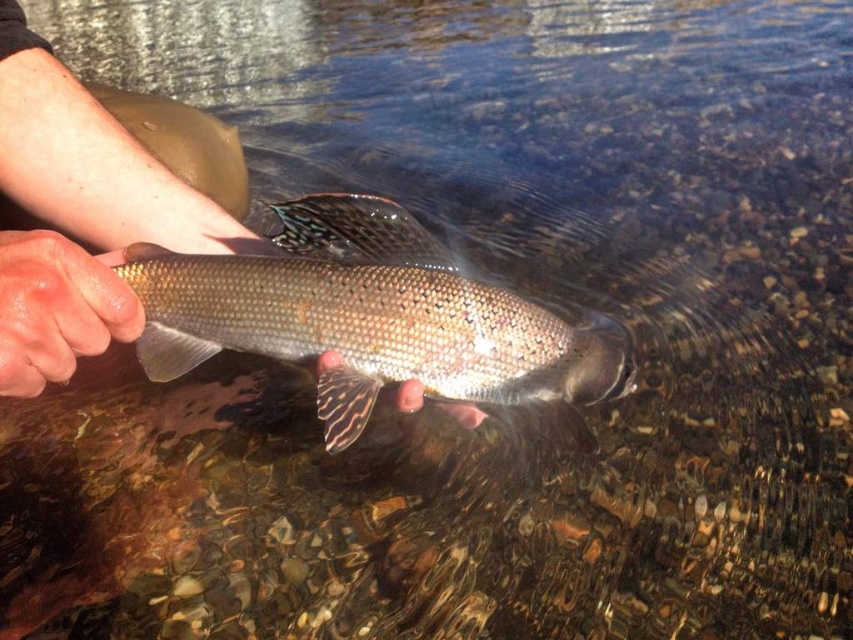
Which is behind, point (405, 234) or point (76, 284)?

Positioned behind is point (405, 234).

Can you confirm if shiny silver fish at center is positioned to the right of smooth skin hand at center?

Correct, you'll find shiny silver fish at center to the right of smooth skin hand at center.

Does point (590, 337) come farther from viewer compared to point (90, 308)?

Yes, point (590, 337) is behind point (90, 308).

Locate an element on the screen. The width and height of the screenshot is (853, 640). shiny silver fish at center is located at coordinates (370, 317).

Is shiny silver fish at center positioned behind dry skin at center?

Yes.

Which is in front, point (352, 438) or point (3, 392)?

Point (3, 392) is in front.

Measure the distance between point (276,272) and camera.

The distance of point (276,272) from camera is 23.69 inches.

Where is `shiny silver fish at center`? shiny silver fish at center is located at coordinates (370, 317).

What do you see at coordinates (77, 214) in the screenshot? The height and width of the screenshot is (640, 853). I see `smooth skin hand at center` at bounding box center [77, 214].

You are a GUI agent. You are given a task and a screenshot of the screen. Output one action in this format:
    pyautogui.click(x=<x>, y=<y>)
    Task: Click on the smooth skin hand at center
    The width and height of the screenshot is (853, 640).
    Given the screenshot: What is the action you would take?
    pyautogui.click(x=77, y=214)

Find the location of a particular element. This screenshot has width=853, height=640. smooth skin hand at center is located at coordinates (77, 214).